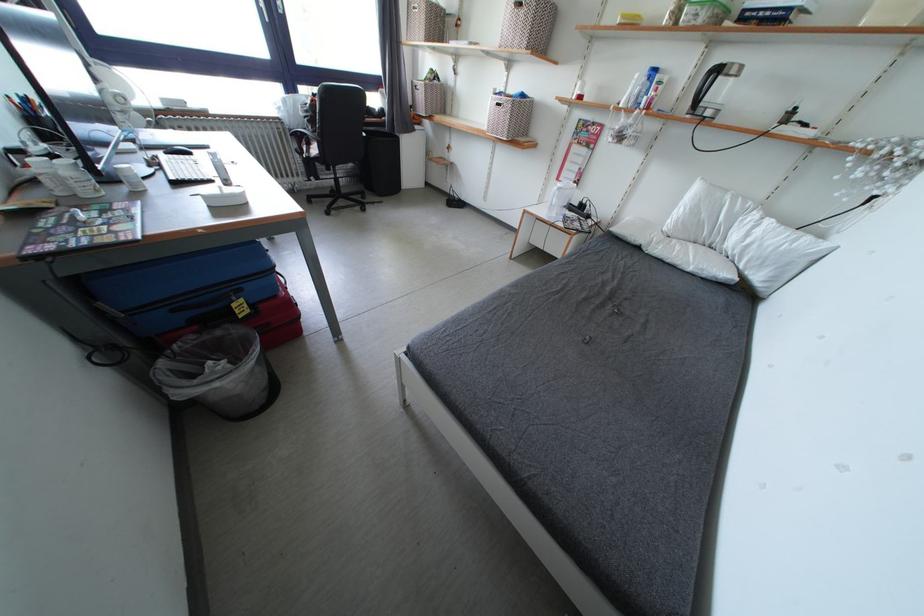
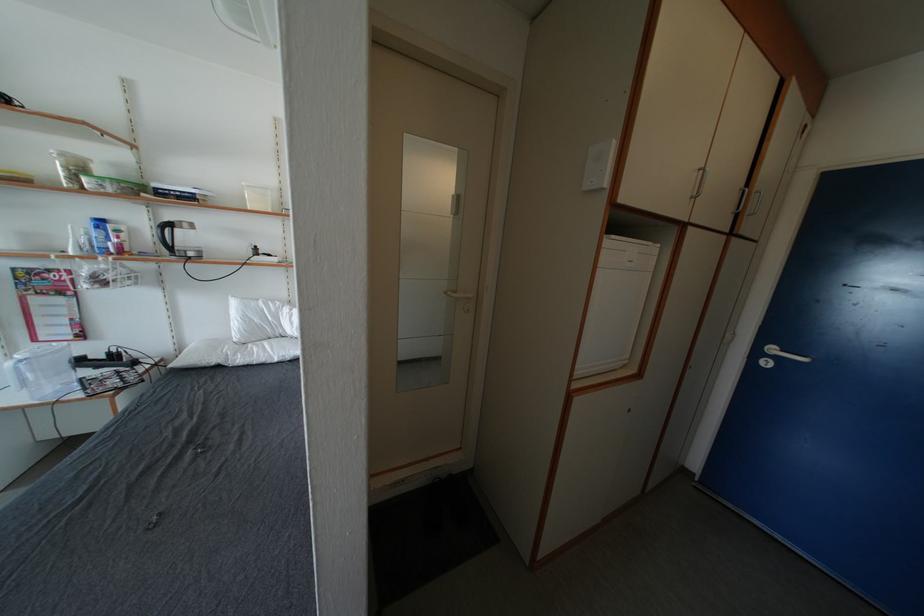
Question: Based on the continuous images, in which direction is the camera rotating? Reply with the corresponding letter.

Choices:
 (A) Left
 (B) Right
 (C) Up
 (D) Down

Answer: (B)